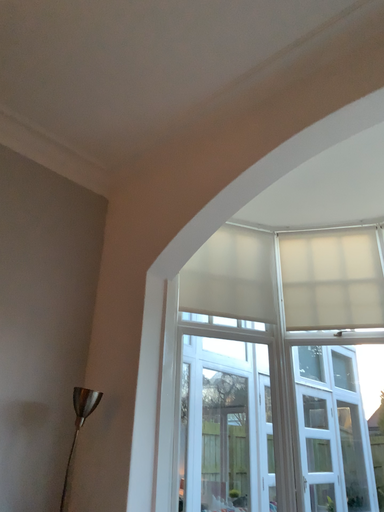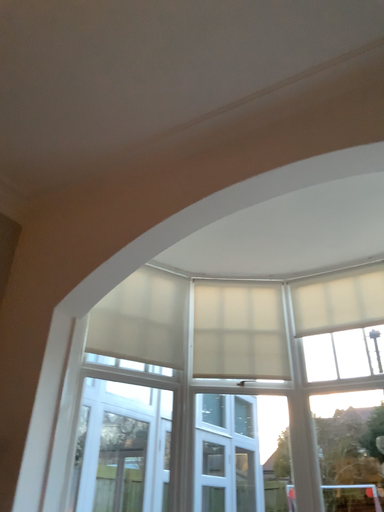
Question: Which way did the camera rotate in the video?

Choices:
 (A) rotated left
 (B) rotated right

Answer: (B)